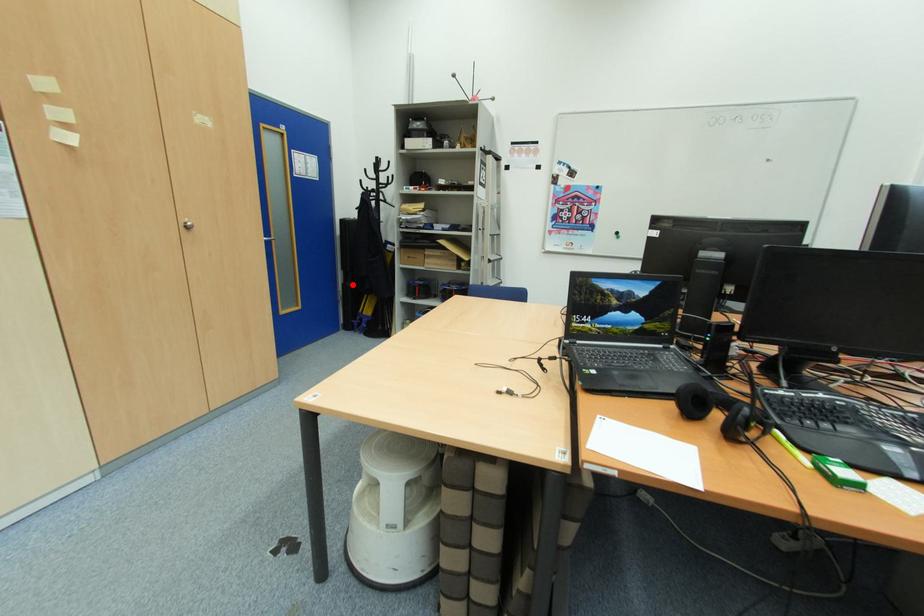
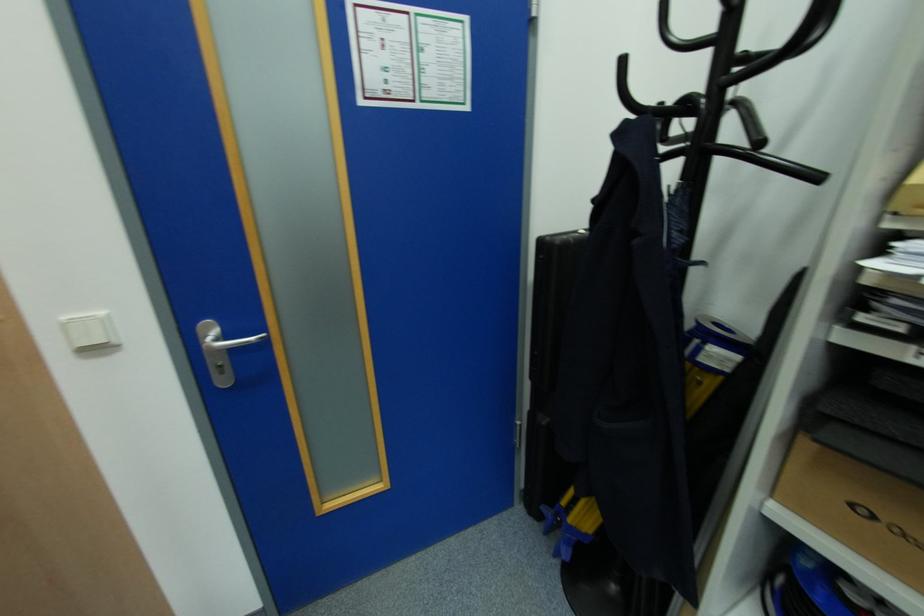
Locate, in the second image, the point that corresponds to the highlighted location in the first image.

(548, 421)